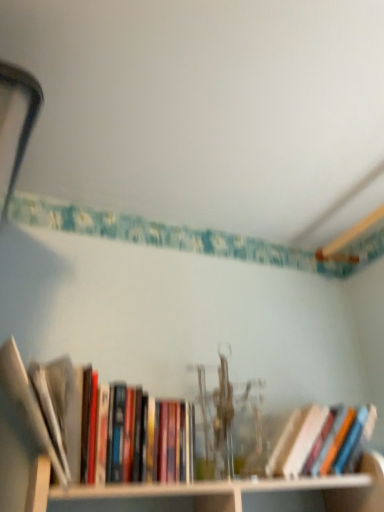
Question: Which direction should I rotate to face hardcover book at center, positioned as the first book in right-to-left order, — up or down?

Choices:
 (A) up
 (B) down

Answer: (B)

Question: Does white wood cabinet at lower center have a smaller size compared to hardcover book at center, the 2th book positioned from the left?

Choices:
 (A) no
 (B) yes

Answer: (A)

Question: Is white wood cabinet at lower center positioned beyond the bounds of hardcover book at center, positioned as the first book in right-to-left order?

Choices:
 (A) no
 (B) yes

Answer: (B)

Question: Can you confirm if white wood cabinet at lower center is positioned to the left of hardcover book at center, the 2th book positioned from the left?

Choices:
 (A) yes
 (B) no

Answer: (A)

Question: From a real-world perspective, does white wood cabinet at lower center stand above hardcover book at center, the 2th book positioned from the left?

Choices:
 (A) no
 (B) yes

Answer: (A)

Question: Is white wood cabinet at lower center shorter than hardcover book at center, positioned as the first book in right-to-left order?

Choices:
 (A) yes
 (B) no

Answer: (A)

Question: From the image's perspective, is white wood cabinet at lower center on top of hardcover book at center, the 2th book positioned from the left?

Choices:
 (A) yes
 (B) no

Answer: (B)

Question: Does hardcover book at center, the 2th book positioned from the left, have a lesser width compared to hardcover books at left, which ranks as the 1th book in left-to-right order?

Choices:
 (A) no
 (B) yes

Answer: (B)

Question: Considering the relative positions of hardcover book at center, positioned as the first book in right-to-left order, and hardcover books at left, the 2th book from the right, in the image provided, is hardcover book at center, positioned as the first book in right-to-left order, to the left of hardcover books at left, the 2th book from the right, from the viewer's perspective?

Choices:
 (A) no
 (B) yes

Answer: (A)

Question: Is hardcover book at center, positioned as the first book in right-to-left order, turned away from hardcover books at left, the 2th book from the right?

Choices:
 (A) yes
 (B) no

Answer: (B)

Question: From the image's perspective, does hardcover book at center, positioned as the first book in right-to-left order, appear higher than hardcover books at left, the 2th book from the right?

Choices:
 (A) yes
 (B) no

Answer: (B)

Question: Is the depth of hardcover book at center, positioned as the first book in right-to-left order, greater than that of hardcover books at left, which ranks as the 1th book in left-to-right order?

Choices:
 (A) no
 (B) yes

Answer: (B)

Question: From a real-world perspective, is hardcover book at center, positioned as the first book in right-to-left order, on hardcover books at left, the 2th book from the right?

Choices:
 (A) yes
 (B) no

Answer: (B)

Question: Does hardcover books at left, the 2th book from the right, have a lesser width compared to hardcover book at center, positioned as the first book in right-to-left order?

Choices:
 (A) no
 (B) yes

Answer: (A)